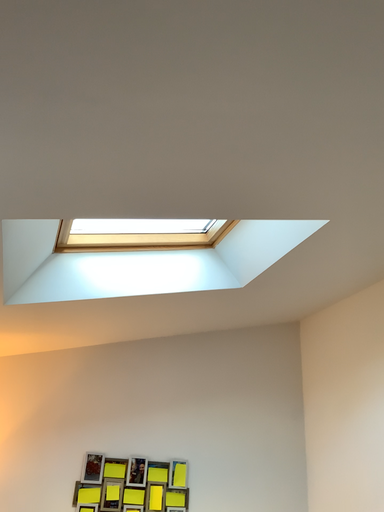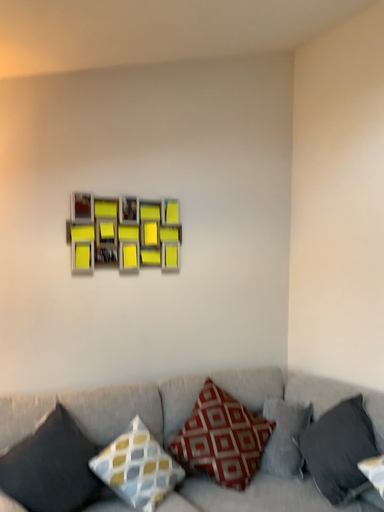
Question: How did the camera likely rotate when shooting the video?

Choices:
 (A) rotated right
 (B) rotated left

Answer: (A)